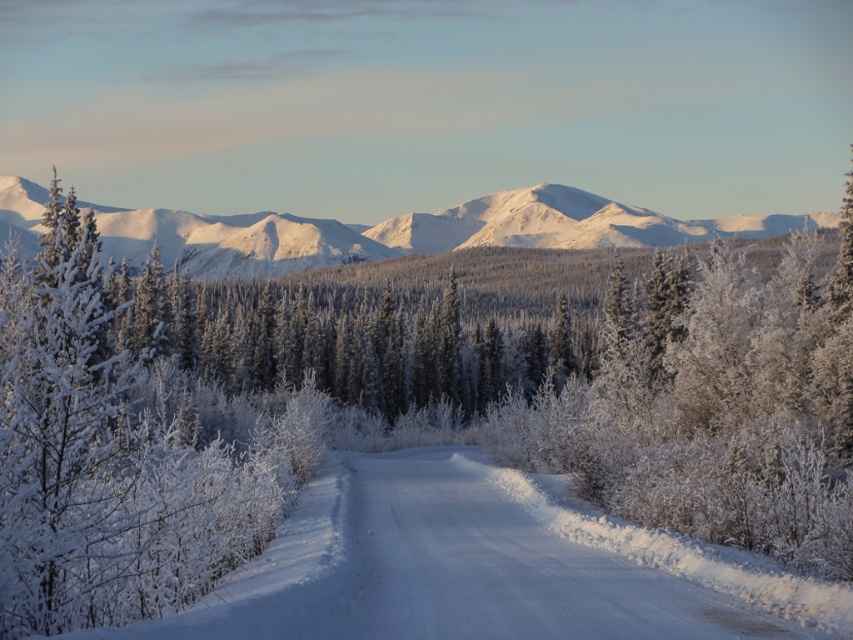
Question: Which point appears closest to the camera in this image?

Choices:
 (A) (202, 611)
 (B) (230, 232)

Answer: (A)

Question: Is white fluffy snow at center behind white snow-covered mountain range at upper center?

Choices:
 (A) yes
 (B) no

Answer: (B)

Question: Among these objects, which one is nearest to the camera?

Choices:
 (A) white snow-covered mountain range at upper center
 (B) white fluffy snow at center

Answer: (B)

Question: Is white fluffy snow at center positioned in front of white snow-covered mountain range at upper center?

Choices:
 (A) no
 (B) yes

Answer: (B)

Question: Which object is positioned farthest from the white snow-covered mountain range at upper center?

Choices:
 (A) white fluffy snow at center
 (B) white frosty tree at upper left

Answer: (A)

Question: Is white fluffy snow at center behind white snow-covered mountain range at upper center?

Choices:
 (A) no
 (B) yes

Answer: (A)